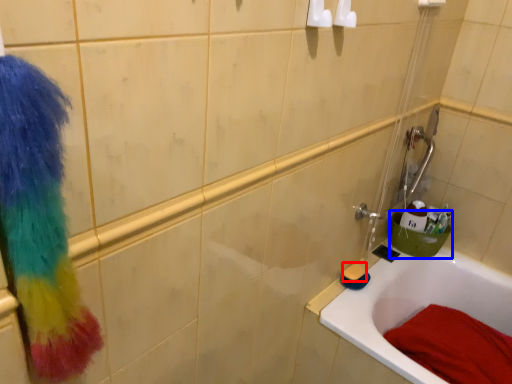
Question: Which point is closer to the camera, soap (highlighted by a red box) or basin (highlighted by a blue box)?

Choices:
 (A) soap
 (B) basin

Answer: (A)